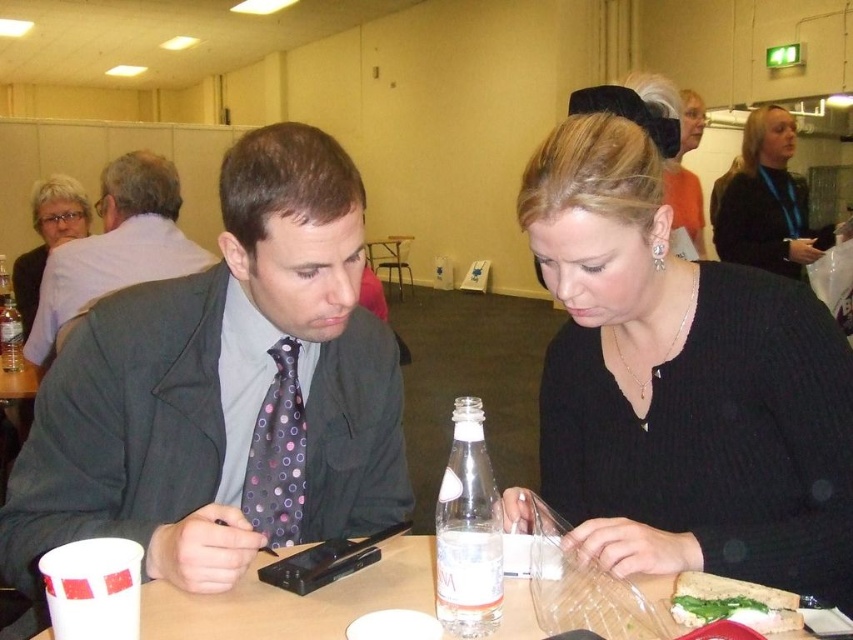
Which is more to the left, dark gray suit at left or green leafy sandwich at lower right?

Positioned to the left is dark gray suit at left.

From the picture: Who is lower down, dark gray suit at left or green leafy sandwich at lower right?

Positioned lower is green leafy sandwich at lower right.

The image size is (853, 640). In order to click on dark gray suit at left in this screenshot , I will do `click(115, 246)`.

Where is `dark gray suit at left`? This screenshot has width=853, height=640. dark gray suit at left is located at coordinates point(115,246).

Is polka dot tie at center positioned at the back of white plastic table at center?

Yes, polka dot tie at center is behind white plastic table at center.

Does polka dot tie at center lie in front of white plastic table at center?

No, polka dot tie at center is further to the viewer.

Between point (28, 508) and point (537, 624), which one is positioned in front?

Point (537, 624) is in front.

Identify the location of polka dot tie at center. (224, 392).

Between dark gray suit at left and transparent plastic bottle at center, which one has less height?

Standing shorter between the two is transparent plastic bottle at center.

Who is positioned more to the right, dark gray suit at left or transparent plastic bottle at center?

Positioned to the right is dark gray suit at left.

Between point (140, 204) and point (3, 268), which one is positioned behind?

Positioned behind is point (3, 268).

I want to click on dark gray suit at left, so click(115, 246).